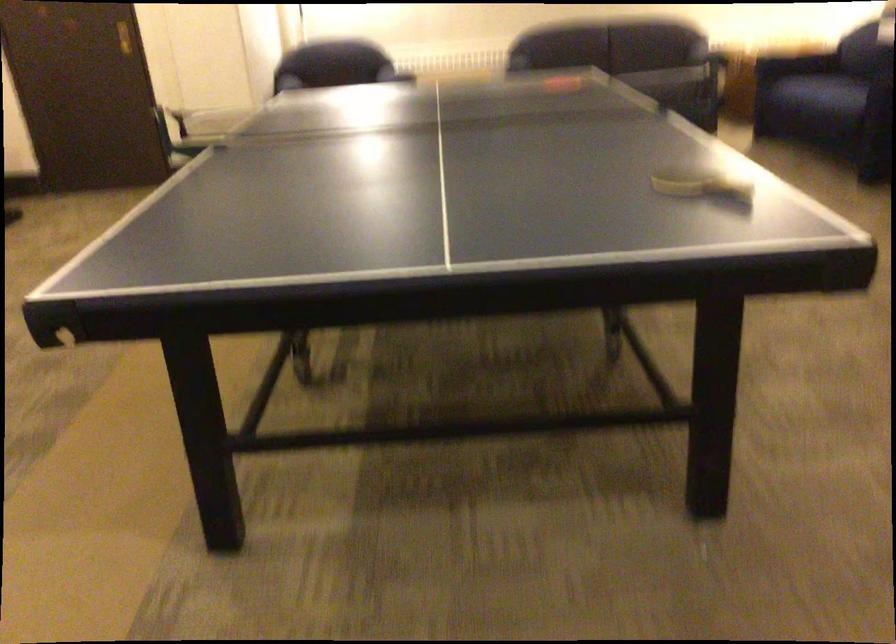
Find where to rest the sofa armrest. Please return your answer as a coordinate pair (x, y).

(794, 64)